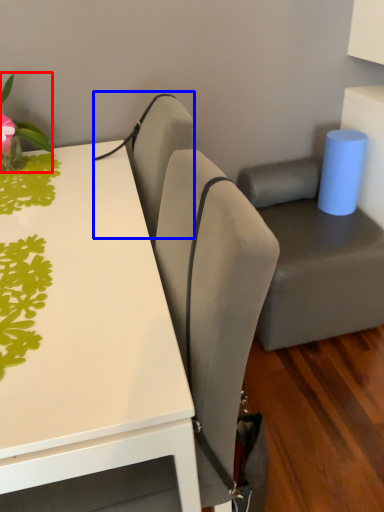
Question: Among these objects, which one is farthest to the camera, plant (highlighted by a red box) or armchair (highlighted by a blue box)?

Choices:
 (A) plant
 (B) armchair

Answer: (B)